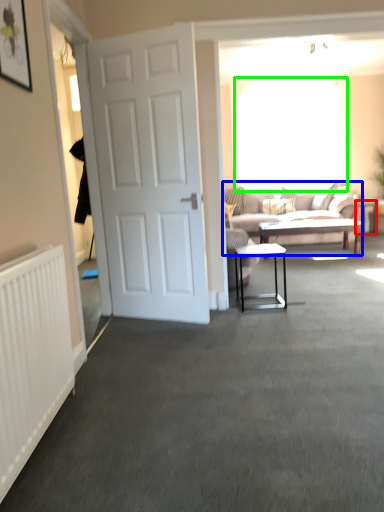
Question: Which object is the closest to the side table (highlighted by a red box)? Choose among these: studio couch (highlighted by a blue box) or window screen (highlighted by a green box).

Choices:
 (A) studio couch
 (B) window screen

Answer: (A)